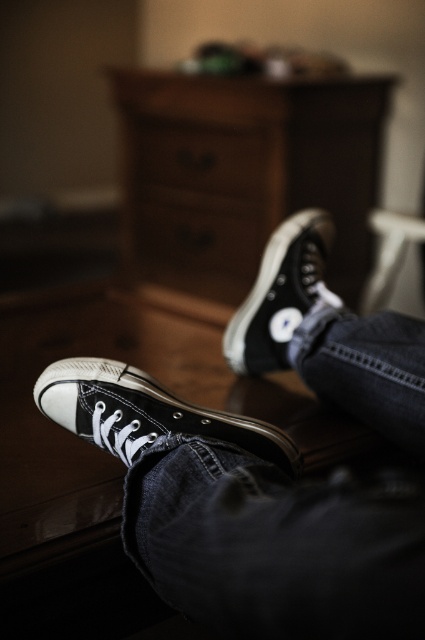
You are a photographer adjusting your camera settings to focus on the black canvas shoe at center and the brown wood drawer at center. Since the camera can only focus on objects of the same height, will you need to adjust the focus for both objects?

The black canvas shoe at center has a lesser height compared to the brown wood drawer at center, so the camera will not focus on both objects simultaneously since their heights differ.

You are trying to decide whether to place a small potted plant on the wooden dresser at center or the black canvas shoe at center. Based on their heights, which surface would be more stable for the plant?

The wooden dresser at center is taller than the black canvas shoe at center, so placing the plant on the wooden dresser at center would provide a more stable surface due to its greater height and likely sturdier construction.